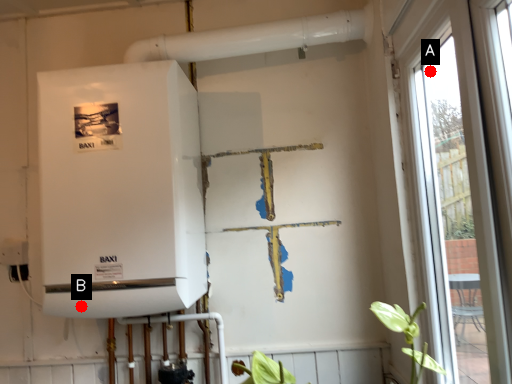
Question: Two points are circled on the image, labeled by A and B beside each circle. Which point is closer to the camera?

Choices:
 (A) A is closer
 (B) B is closer

Answer: (B)